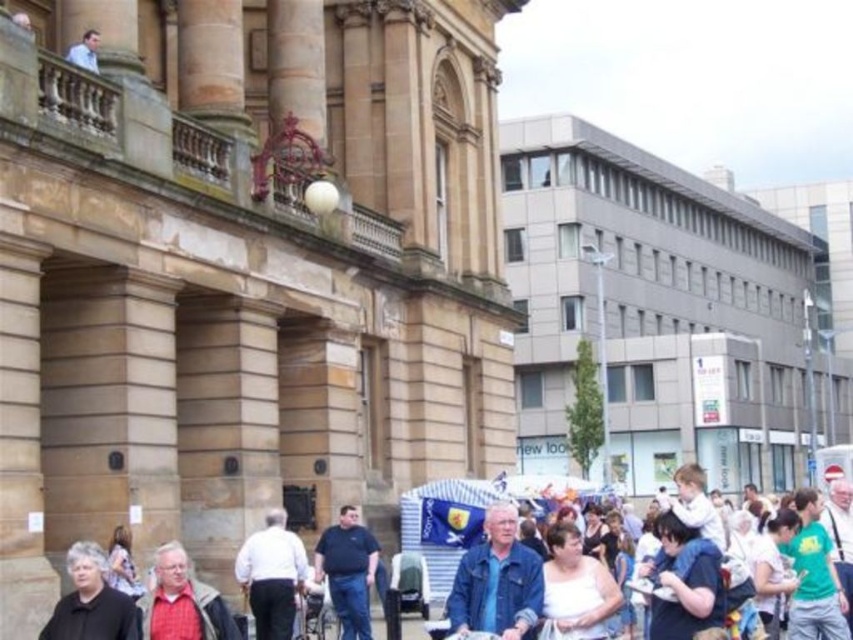
Image resolution: width=853 pixels, height=640 pixels. Describe the element at coordinates (809, 573) in the screenshot. I see `white cotton shirt at lower right` at that location.

Measure the distance between white cotton shirt at lower right and camera.

white cotton shirt at lower right and camera are 27.52 meters apart from each other.

You are a GUI agent. You are given a task and a screenshot of the screen. Output one action in this format:
    pyautogui.click(x=<x>, y=<y>)
    Task: Click on the white cotton shirt at lower right
    The height and width of the screenshot is (640, 853).
    Given the screenshot: What is the action you would take?
    coord(809,573)

Which of these two, white cotton shirt at lower left or light blue shirt at upper left, stands shorter?

Standing shorter between the two is light blue shirt at upper left.

Between white cotton shirt at lower left and light blue shirt at upper left, which one appears on the left side from the viewer's perspective?

From the viewer's perspective, light blue shirt at upper left appears more on the left side.

Is point (129, 548) positioned behind point (67, 58)?

That is False.

Where is `white cotton shirt at lower left`? This screenshot has width=853, height=640. white cotton shirt at lower left is located at coordinates (122, 564).

Is denim jacket at center taller than dark gray sweater at lower left?

Yes, denim jacket at center is taller than dark gray sweater at lower left.

At what (x,y) coordinates should I click in order to perform the action: click on denim jacket at center. Please return your answer as a coordinate pair (x, y). Looking at the image, I should click on (497, 580).

The image size is (853, 640). What are the coordinates of `denim jacket at center` in the screenshot? It's located at (497, 580).